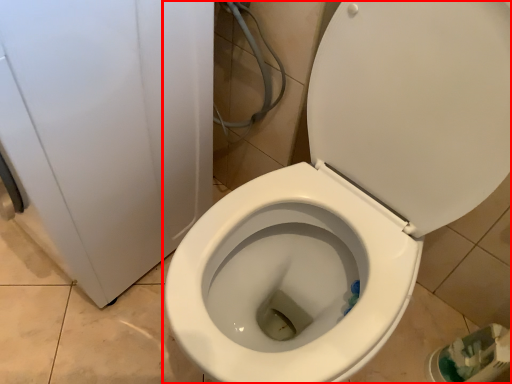
Question: From the image's perspective, what is the correct spatial positioning of toilet (annotated by the red box) in reference to porcelain?

Choices:
 (A) below
 (B) above

Answer: (A)